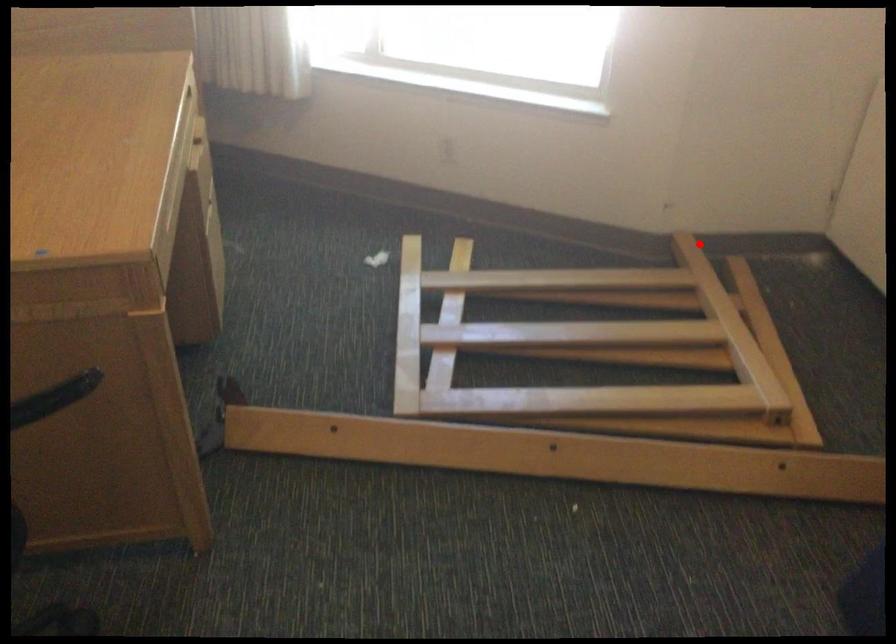
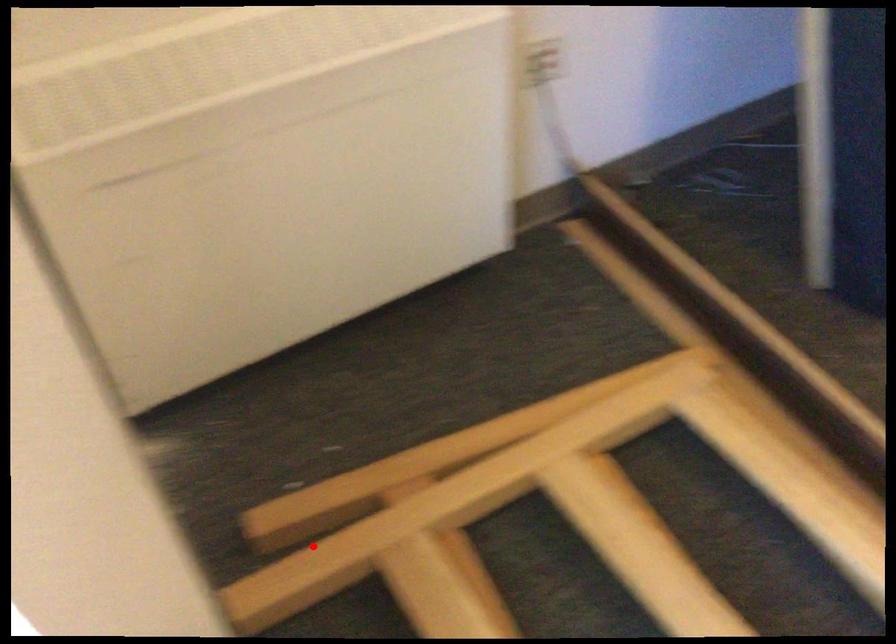
I am providing you with two images of the same scene from different viewpoints. A red point is marked on the first image and another point is marked on the second image. Is the marked point in image1 the same physical position as the marked point in image2?

Yes